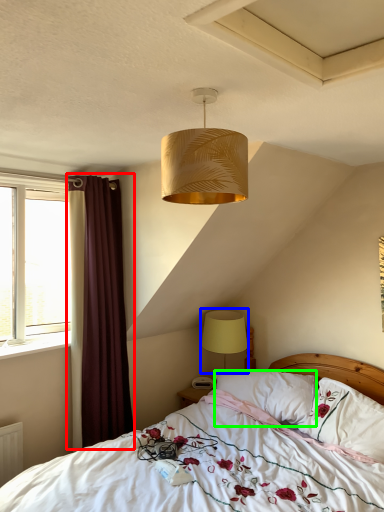
Question: Estimate the real-world distances between objects in this image. Which object is closer to curtain (highlighted by a red box), lamp (highlighted by a blue box) or pillow (highlighted by a green box)?

Choices:
 (A) lamp
 (B) pillow

Answer: (A)